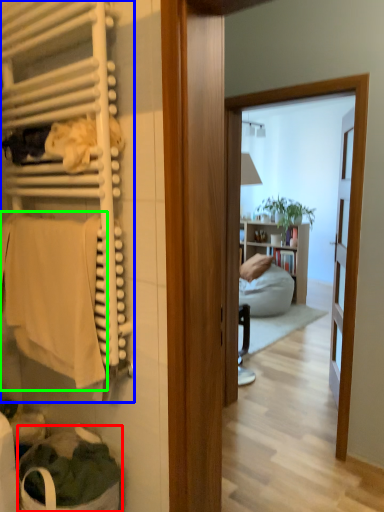
Question: Based on their relative distances, which object is farther from laundry basket (highlighted by a red box)? Choose from closet (highlighted by a blue box) and bath towel (highlighted by a green box).

Choices:
 (A) closet
 (B) bath towel

Answer: (A)